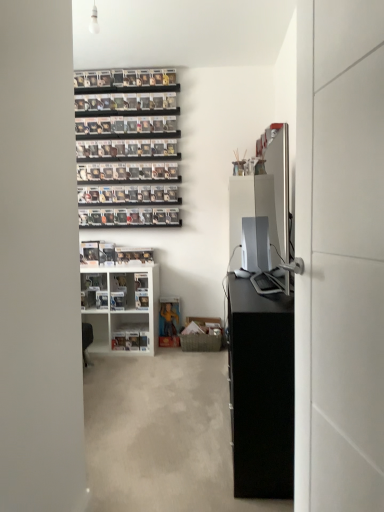
Question: From a real-world perspective, is white glossy door at right positioned above or below satin silver desktop at center?

Choices:
 (A) below
 (B) above

Answer: (B)

Question: Considering the positions of white glossy door at right and satin silver desktop at center in the image, is white glossy door at right wider or thinner than satin silver desktop at center?

Choices:
 (A) thin
 (B) wide

Answer: (A)

Question: Estimate the real-world distances between objects in this image. Which object is farther from the white glossy shelf at center, which is counted as the first shelf, starting from the top?

Choices:
 (A) satin silver desktop at center
 (B) black matte cabinet at right
 (C) white plastic shelf at lower center, which appears as the first shelf when ordered from the bottom
 (D) white glossy door at right

Answer: (D)

Question: Which is farther from the black matte cabinet at right?

Choices:
 (A) satin silver desktop at center
 (B) white plastic shelf at lower center, the 2th shelf when ordered from top to bottom
 (C) white glossy shelf at center, which is counted as the first shelf, starting from the top
 (D) white glossy door at right

Answer: (B)